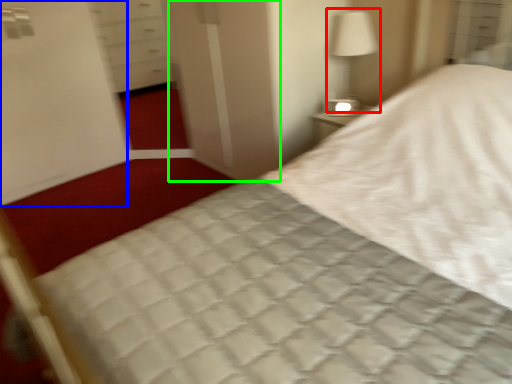
Question: Which is farther away from bedside lamp (highlighted by a red box)? screen door (highlighted by a blue box) or screen door (highlighted by a green box)?

Choices:
 (A) screen door
 (B) screen door

Answer: (A)